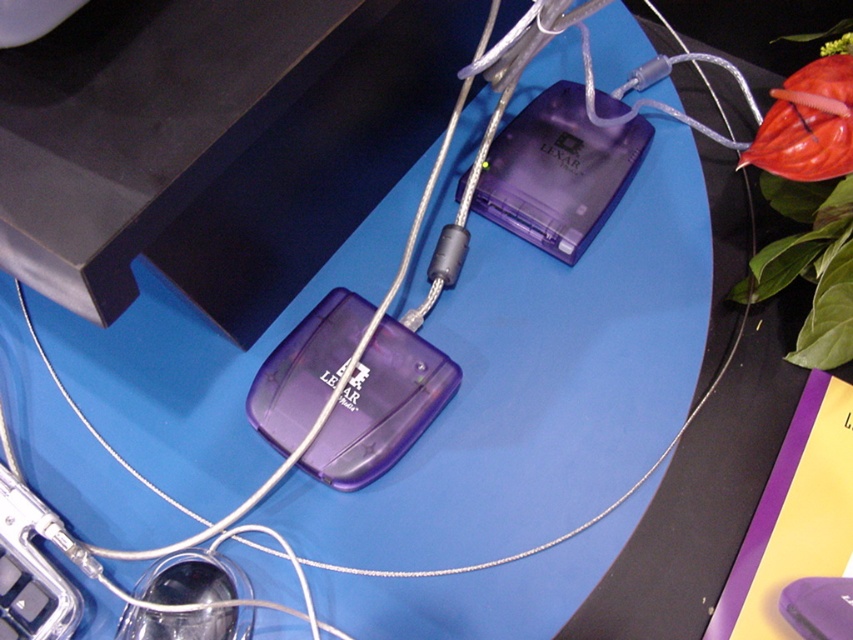
What do you see at coordinates (558, 172) in the screenshot? I see `transparent plastic lexar flash drive at center` at bounding box center [558, 172].

Which is behind, point (548, 236) or point (172, 582)?

The point (548, 236) is more distant.

Between point (480, 182) and point (198, 609), which one is positioned behind?

The point (480, 182) is more distant.

At what (x,y) coordinates should I click in order to perform the action: click on transparent plastic lexar flash drive at center. Please return your answer as a coordinate pair (x, y). Looking at the image, I should click on (558, 172).